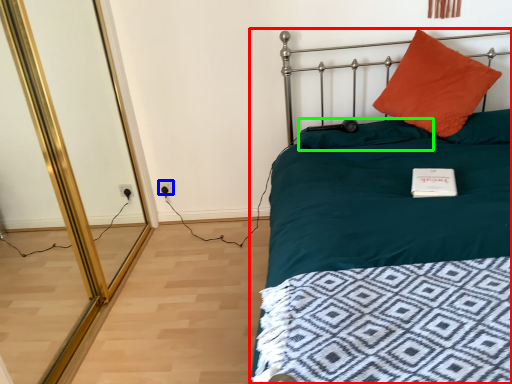
Question: Which object is positioned closest to bed (highlighted by a red box)? Select from electric outlet (highlighted by a blue box) and pillow (highlighted by a green box).

Choices:
 (A) electric outlet
 (B) pillow

Answer: (B)